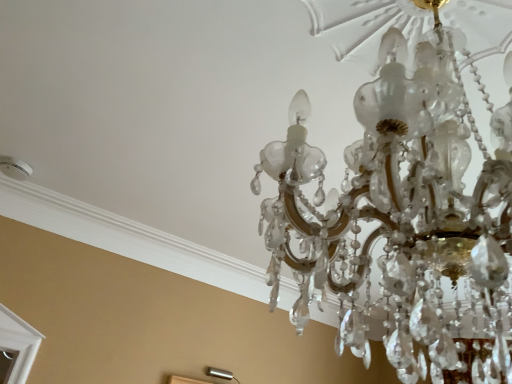
Identify the location of clear crystal chandelier at upper center, the 2th lamp from the back. (404, 216).

Measure the distance between clear crystal chandelier at upper center, which is counted as the 1th lamp, starting from the front, and camera.

A distance of 17.49 inches exists between clear crystal chandelier at upper center, which is counted as the 1th lamp, starting from the front, and camera.

The height and width of the screenshot is (384, 512). What do you see at coordinates (404, 216) in the screenshot?
I see `clear crystal chandelier at upper center, which is counted as the 1th lamp, starting from the front` at bounding box center [404, 216].

Consider the image. What is the approximate width of silver metallic lamp at lower center, the 1th lamp when ordered from bottom to top?

It is 1.76 inches.

What do you see at coordinates (220, 374) in the screenshot?
I see `silver metallic lamp at lower center, acting as the 2th lamp starting from the right` at bounding box center [220, 374].

Identify the location of silver metallic lamp at lower center, acting as the 2th lamp starting from the right. This screenshot has height=384, width=512. (220, 374).

This screenshot has width=512, height=384. I want to click on clear crystal chandelier at upper center, the first lamp when ordered from right to left, so click(404, 216).

Which object is positioned more to the left, clear crystal chandelier at upper center, which is counted as the second lamp, starting from the bottom, or silver metallic lamp at lower center, acting as the 2th lamp starting from the right?

Positioned to the left is silver metallic lamp at lower center, acting as the 2th lamp starting from the right.

Based on the photo, is clear crystal chandelier at upper center, which is counted as the second lamp, starting from the bottom, closer to the viewer compared to silver metallic lamp at lower center, the first lamp from the back?

Yes, the depth of clear crystal chandelier at upper center, which is counted as the second lamp, starting from the bottom, is less than that of silver metallic lamp at lower center, the first lamp from the back.

Which is closer to the camera, [342,209] or [217,372]?

Point [342,209] appears to be closer to the viewer than point [217,372].

From the image's perspective, is clear crystal chandelier at upper center, which is counted as the 1th lamp, starting from the front, located above silver metallic lamp at lower center, acting as the second lamp starting from the top?

Correct, clear crystal chandelier at upper center, which is counted as the 1th lamp, starting from the front, appears higher than silver metallic lamp at lower center, acting as the second lamp starting from the top, in the image.

From a real-world perspective, which object stands above the other?

clear crystal chandelier at upper center, which is counted as the second lamp, starting from the bottom, from a real-world perspective.

Can you confirm if clear crystal chandelier at upper center, the 1th lamp from the top, is thinner than silver metallic lamp at lower center, acting as the 2th lamp starting from the right?

No, clear crystal chandelier at upper center, the 1th lamp from the top, is not thinner than silver metallic lamp at lower center, acting as the 2th lamp starting from the right.

Does clear crystal chandelier at upper center, which is counted as the 1th lamp, starting from the front, have a lesser height compared to silver metallic lamp at lower center, acting as the second lamp starting from the top?

No, clear crystal chandelier at upper center, which is counted as the 1th lamp, starting from the front, is not shorter than silver metallic lamp at lower center, acting as the second lamp starting from the top.

Can you confirm if clear crystal chandelier at upper center, the 2th lamp in the left-to-right sequence, is bigger than silver metallic lamp at lower center, acting as the second lamp starting from the top?

Yes, clear crystal chandelier at upper center, the 2th lamp in the left-to-right sequence, is bigger than silver metallic lamp at lower center, acting as the second lamp starting from the top.

Is silver metallic lamp at lower center, acting as the 2th lamp starting from the front, inside clear crystal chandelier at upper center, the 1th lamp from the top?

No, silver metallic lamp at lower center, acting as the 2th lamp starting from the front, is not surrounded by clear crystal chandelier at upper center, the 1th lamp from the top.

Is clear crystal chandelier at upper center, the 2th lamp in the left-to-right sequence, next to silver metallic lamp at lower center, acting as the 2th lamp starting from the right?

clear crystal chandelier at upper center, the 2th lamp in the left-to-right sequence, and silver metallic lamp at lower center, acting as the 2th lamp starting from the right, are clearly separated.

Is clear crystal chandelier at upper center, which is counted as the second lamp, starting from the bottom, turned away from silver metallic lamp at lower center, acting as the 2th lamp starting from the front?

No, clear crystal chandelier at upper center, which is counted as the second lamp, starting from the bottom, is not facing the opposite direction of silver metallic lamp at lower center, acting as the 2th lamp starting from the front.

How different are the orientations of clear crystal chandelier at upper center, the 2th lamp in the left-to-right sequence, and silver metallic lamp at lower center, the 1th lamp viewed from the left, in degrees?

clear crystal chandelier at upper center, the 2th lamp in the left-to-right sequence, and silver metallic lamp at lower center, the 1th lamp viewed from the left, are facing 175 degrees away from each other.

The image size is (512, 384). I want to click on lamp behind the clear crystal chandelier at upper center, the 2th lamp in the left-to-right sequence, so click(x=220, y=374).

Is silver metallic lamp at lower center, the 1th lamp when ordered from bottom to top, to the right of clear crystal chandelier at upper center, the first lamp when ordered from right to left, from the viewer's perspective?

No, silver metallic lamp at lower center, the 1th lamp when ordered from bottom to top, is not to the right of clear crystal chandelier at upper center, the first lamp when ordered from right to left.

Which object is closer to the camera, silver metallic lamp at lower center, acting as the 2th lamp starting from the right, or clear crystal chandelier at upper center, which is counted as the 1th lamp, starting from the front?

Positioned in front is clear crystal chandelier at upper center, which is counted as the 1th lamp, starting from the front.

Is point (227, 372) closer or farther from the camera than point (510, 172)?

Clearly, point (227, 372) is more distant from the camera than point (510, 172).

From the image's perspective, which one is positioned lower, silver metallic lamp at lower center, the 1th lamp when ordered from bottom to top, or clear crystal chandelier at upper center, which is counted as the 1th lamp, starting from the front?

From the image's view, silver metallic lamp at lower center, the 1th lamp when ordered from bottom to top, is below.

From a real-world perspective, between silver metallic lamp at lower center, acting as the 2th lamp starting from the right, and clear crystal chandelier at upper center, the 2th lamp in the left-to-right sequence, who is vertically lower?

silver metallic lamp at lower center, acting as the 2th lamp starting from the right, from a real-world perspective.

Which of these two, silver metallic lamp at lower center, the 1th lamp when ordered from bottom to top, or clear crystal chandelier at upper center, the 2th lamp from the back, is thinner?

Thinner between the two is silver metallic lamp at lower center, the 1th lamp when ordered from bottom to top.

Can you confirm if silver metallic lamp at lower center, the first lamp from the back, is shorter than clear crystal chandelier at upper center, the first lamp when ordered from right to left?

Yes, silver metallic lamp at lower center, the first lamp from the back, is shorter than clear crystal chandelier at upper center, the first lamp when ordered from right to left.

Between silver metallic lamp at lower center, the 1th lamp when ordered from bottom to top, and clear crystal chandelier at upper center, the 2th lamp in the left-to-right sequence, which one has smaller size?

With smaller size is silver metallic lamp at lower center, the 1th lamp when ordered from bottom to top.

Is silver metallic lamp at lower center, the first lamp from the back, completely or partially outside of clear crystal chandelier at upper center, the first lamp when ordered from right to left?

Yes, silver metallic lamp at lower center, the first lamp from the back, is outside of clear crystal chandelier at upper center, the first lamp when ordered from right to left.

Is silver metallic lamp at lower center, the 1th lamp when ordered from bottom to top, not close to clear crystal chandelier at upper center, which is counted as the 1th lamp, starting from the front?

silver metallic lamp at lower center, the 1th lamp when ordered from bottom to top, is positioned a significant distance from clear crystal chandelier at upper center, which is counted as the 1th lamp, starting from the front.

Is clear crystal chandelier at upper center, which is counted as the 1th lamp, starting from the front, at the back of silver metallic lamp at lower center, the 1th lamp viewed from the left?

No.

What's the angular difference between silver metallic lamp at lower center, the 1th lamp viewed from the left, and clear crystal chandelier at upper center, which is counted as the 1th lamp, starting from the front,'s facing directions?

The angle between the facing direction of silver metallic lamp at lower center, the 1th lamp viewed from the left, and the facing direction of clear crystal chandelier at upper center, which is counted as the 1th lamp, starting from the front, is 175 degrees.

At what (x,y) coordinates should I click in order to perform the action: click on lamp located underneath the clear crystal chandelier at upper center, the 2th lamp in the left-to-right sequence (from a real-world perspective). Please return your answer as a coordinate pair (x, y). The width and height of the screenshot is (512, 384). Looking at the image, I should click on (220, 374).

Where is `lamp in front of the silver metallic lamp at lower center, the 1th lamp when ordered from bottom to top`? Image resolution: width=512 pixels, height=384 pixels. lamp in front of the silver metallic lamp at lower center, the 1th lamp when ordered from bottom to top is located at coordinates (404, 216).

In the image, there is a silver metallic lamp at lower center, the first lamp from the back. What are the coordinates of `lamp above it (from the image's perspective)` in the screenshot? It's located at (404, 216).